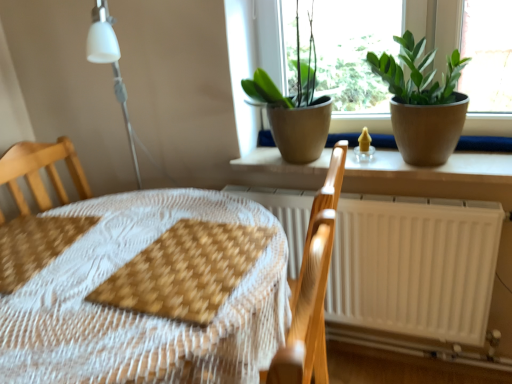
Where is `vacant space to the right of matte yellow candle holder at center`? Image resolution: width=512 pixels, height=384 pixels. vacant space to the right of matte yellow candle holder at center is located at coordinates click(x=400, y=154).